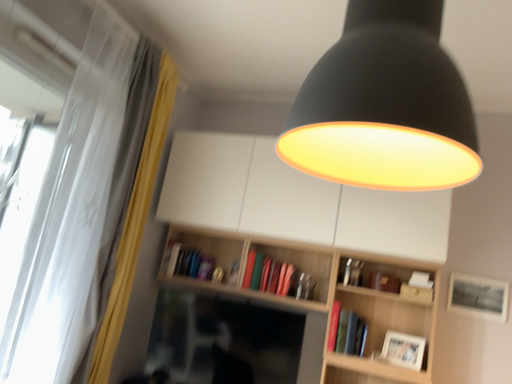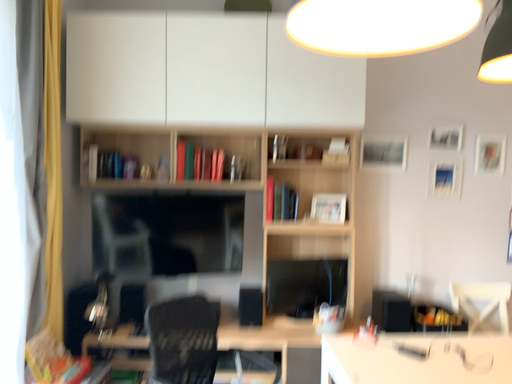
Question: How did the camera likely rotate when shooting the video?

Choices:
 (A) rotated right
 (B) rotated left

Answer: (A)